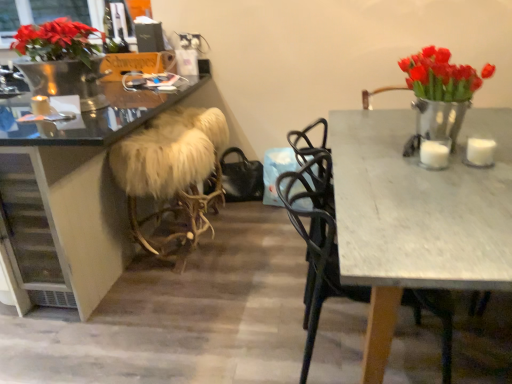
Where is `shiny metallic vase with red tulips at right`? shiny metallic vase with red tulips at right is located at coordinates (439, 94).

Image resolution: width=512 pixels, height=384 pixels. What are the coordinates of `matte black desk at left` in the screenshot? It's located at (73, 201).

The height and width of the screenshot is (384, 512). Describe the element at coordinates (173, 172) in the screenshot. I see `white fur-covered stool at center` at that location.

I want to click on white marble table at right, so click(x=417, y=216).

Measure the distance between white marble table at right and camera.

They are 33.79 inches apart.

Identify the location of shiny metallic vase with red tulips at right. point(439,94).

Is white matte candle at right, the third candle in the left-to-right sequence, completely or partially outside of shiny metallic vase with red tulips at right?

Absolutely, white matte candle at right, the third candle in the left-to-right sequence, is external to shiny metallic vase with red tulips at right.

Would you consider white matte candle at right, the third candle in the left-to-right sequence, to be distant from shiny metallic vase with red tulips at right?

No, white matte candle at right, the third candle in the left-to-right sequence, is in close proximity to shiny metallic vase with red tulips at right.

Is white matte candle at right, which is the second candle in bottom-to-top order, to the left or to the right of shiny metallic vase with red tulips at right in the image?

white matte candle at right, which is the second candle in bottom-to-top order, is positioned on shiny metallic vase with red tulips at right's right side.

Which object is further away from the camera, white matte candle at right, placed as the 2th candle when sorted from front to back, or shiny metallic vase with red tulips at right?

Positioned behind is white matte candle at right, placed as the 2th candle when sorted from front to back.

In the scene shown: From a real-world perspective, is white marble table at right above or below shiny metallic vase with red tulips at right?

In terms of real-world spatial position, white marble table at right is below shiny metallic vase with red tulips at right.

Which object is further away from the camera taking this photo, white marble table at right or shiny metallic vase with red tulips at right?

shiny metallic vase with red tulips at right is behind.

Is white marble table at right next to shiny metallic vase with red tulips at right?

No.

Which of these two, white marble table at right or shiny metallic vase with red tulips at right, is wider?

With larger width is white marble table at right.

Is black metal chair at upper right positioned far away from white marble table at right?

No.

Which object is further away from the camera, black metal chair at upper right or white marble table at right?

black metal chair at upper right.

Can you confirm if black metal chair at upper right is positioned to the right of white marble table at right?

In fact, black metal chair at upper right is to the left of white marble table at right.

Based on the photo, is black metal chair at upper right positioned with its back to white marble table at right?

Yes, black metal chair at upper right is positioned with its back facing white marble table at right.

Is the depth of white fur-covered stool at center greater than that of white matte candle at right, placed as the 2th candle when sorted from front to back?

Yes, the depth of white fur-covered stool at center is greater than that of white matte candle at right, placed as the 2th candle when sorted from front to back.

Is white fur-covered stool at center bigger than white matte candle at right, the second candle when ordered from top to bottom?

Correct, white fur-covered stool at center is larger in size than white matte candle at right, the second candle when ordered from top to bottom.

Between white fur-covered stool at center and white matte candle at right, the third candle in the left-to-right sequence, which one appears on the left side from the viewer's perspective?

white fur-covered stool at center.

Between point (450, 95) and point (428, 161), which one is positioned in front?

The point (428, 161) is closer to the camera.

At what (x,y) coordinates should I click in order to perform the action: click on floral arrangement above the white matte candle at right, marked as the first candle in a front-to-back arrangement (from a real-world perspective). Please return your answer as a coordinate pair (x, y). The height and width of the screenshot is (384, 512). Looking at the image, I should click on (439, 94).

In terms of height, does shiny metallic vase with red tulips at right look taller or shorter compared to white matte candle at right, acting as the first candle starting from the bottom?

Clearly, shiny metallic vase with red tulips at right is taller compared to white matte candle at right, acting as the first candle starting from the bottom.

Which object is closer to the camera, shiny metallic vase with red tulips at right or white matte candle at right, marked as the first candle in a front-to-back arrangement?

shiny metallic vase with red tulips at right.

From a real-world perspective, which object rests below the other?

matte black desk at left is physically lower.

How far apart are white matte candle at right, the third candle in the left-to-right sequence, and matte black desk at left?

They are 1.70 meters apart.

Is white matte candle at right, placed as the 2th candle when sorted from front to back, positioned far away from matte black desk at left?

white matte candle at right, placed as the 2th candle when sorted from front to back, is far away from matte black desk at left.

Does white matte candle at right, which is the second candle in bottom-to-top order, have a lesser height compared to matte black desk at left?

Correct, white matte candle at right, which is the second candle in bottom-to-top order, is not as tall as matte black desk at left.

Is point (198, 174) positioned behind point (428, 145)?

That is True.

Are white fur-covered stool at center and white matte candle at right, which is the second candle in left-to-right order, located far from each other?

white fur-covered stool at center is positioned a significant distance from white matte candle at right, which is the second candle in left-to-right order.

Is white fur-covered stool at center positioned behind white matte candle at right, the third candle from the back?

Yes, white fur-covered stool at center is further from the camera.

From the image's perspective, which candle is the 1st one above the white fur-covered stool at center? Please provide its 2D coordinates.

[(434, 154)]

Which candle is the 2nd one when counting from the back of the shiny metallic vase with red tulips at right? Please provide its 2D coordinates.

[(480, 151)]

This screenshot has height=384, width=512. I want to click on kitchen & dining room table that is below the shiny metallic vase with red tulips at right (from the image's perspective), so click(417, 216).

Which object lies further to the anchor point white fur-covered stool at center, white marble table at right or white matte candle at left, acting as the first candle starting from the left?

Based on the image, white marble table at right appears to be further to white fur-covered stool at center.

From the image, which object appears to be farther from white fur-covered stool at center, black metal chair at upper right or white matte candle at right, the third candle from the back?

white matte candle at right, the third candle from the back, is positioned further to the anchor white fur-covered stool at center.

Estimate the real-world distances between objects in this image. Which object is further from black metal chair at upper right, white marble table at right or shiny metallic vase with red tulips at right?

The object further to black metal chair at upper right is shiny metallic vase with red tulips at right.

Based on their spatial positions, is white marble table at right or white matte candle at right, placed as the 2th candle when sorted from front to back, closer to shiny metallic vase with red tulips at right?

white matte candle at right, placed as the 2th candle when sorted from front to back.

Looking at the image, which one is located closer to white matte candle at right, placed as the 2th candle when sorted from front to back, white marble table at right or shiny metallic vase with red tulips at right?

Based on the image, shiny metallic vase with red tulips at right appears to be nearer to white matte candle at right, placed as the 2th candle when sorted from front to back.

Looking at the image, which one is located closer to white matte candle at right, the third candle from the back, white matte candle at right, which is the second candle in bottom-to-top order, or shiny metallic vase with red tulips at right?

white matte candle at right, which is the second candle in bottom-to-top order, is closer to white matte candle at right, the third candle from the back.

Based on their spatial positions, is white marble table at right or white fur-covered stool at center closer to white matte candle at left, placed as the third candle when sorted from bottom to top?

The object closer to white matte candle at left, placed as the third candle when sorted from bottom to top, is white fur-covered stool at center.

Estimate the real-world distances between objects in this image. Which object is closer to matte black desk at left, white fur-covered stool at center or black metal chair at upper right?

white fur-covered stool at center is closer to matte black desk at left.

Where is `chair between matte black desk at left and white matte candle at right, which is the second candle in bottom-to-top order, in the horizontal direction`? chair between matte black desk at left and white matte candle at right, which is the second candle in bottom-to-top order, in the horizontal direction is located at coordinates (316, 238).

Locate an element on the screen. Image resolution: width=512 pixels, height=384 pixels. kitchen & dining room table between matte black desk at left and white matte candle at right, the third candle in the left-to-right sequence is located at coordinates (417, 216).

Locate an element on the screen. Image resolution: width=512 pixels, height=384 pixels. floral arrangement positioned between white marble table at right and white matte candle at right, acting as the first candle starting from the bottom, from near to far is located at coordinates (439, 94).

You are a GUI agent. You are given a task and a screenshot of the screen. Output one action in this format:
    pyautogui.click(x=<x>, y=<y>)
    Task: Click on the candle between white matte candle at left, acting as the first candle starting from the left, and white matte candle at right, which is counted as the 1th candle, starting from the right, from left to right
    Image resolution: width=512 pixels, height=384 pixels.
    Given the screenshot: What is the action you would take?
    pyautogui.click(x=434, y=154)